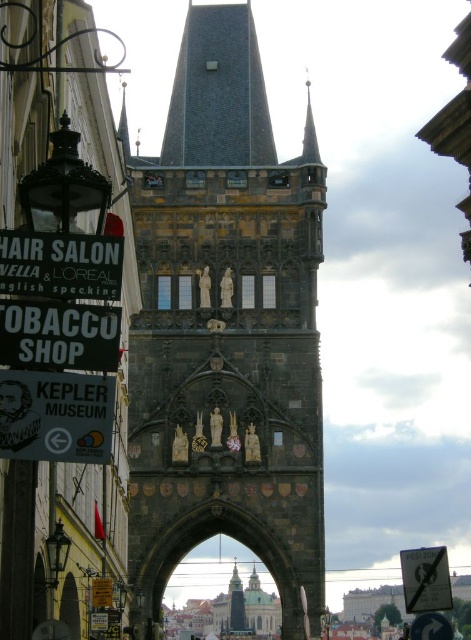
Question: Is white paper sign at lower left wider than black plastic signboard at lower left?

Choices:
 (A) yes
 (B) no

Answer: (A)

Question: From the image, what is the correct spatial relationship of black plastic signboard at lower left in relation to white plastic sign at lower right?

Choices:
 (A) right
 (B) left

Answer: (B)

Question: Which is farther from the dark gray stone tower at center?

Choices:
 (A) black plastic signboard at lower left
 (B) white paper sign at lower left

Answer: (A)

Question: Which of the following is the farthest from the observer?

Choices:
 (A) black plastic hair salon sign at upper left
 (B) black plastic signboard at lower left
 (C) white paper sign at lower left

Answer: (A)

Question: Among these objects, which one is nearest to the camera?

Choices:
 (A) white plastic sign at lower right
 (B) black plastic signboard at lower left

Answer: (B)

Question: Is dark gray stone tower at center positioned at the back of white paper sign at lower left?

Choices:
 (A) yes
 (B) no

Answer: (A)